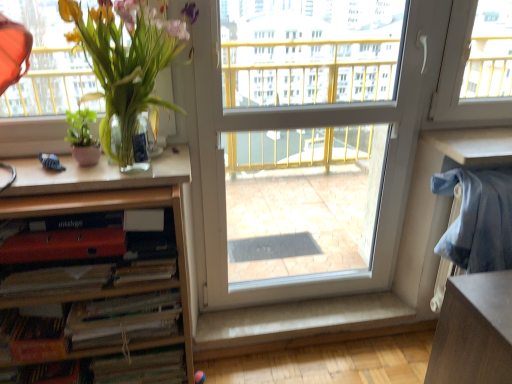
Image resolution: width=512 pixels, height=384 pixels. Identify the location of free location above wooden bookshelf at left (from a real-world perspective). (62, 187).